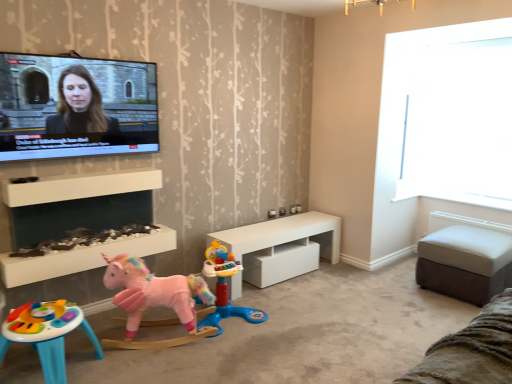
Question: Is transparent glass window at upper right at the back of white glossy table at center, the 2th table positioned from the right?

Choices:
 (A) yes
 (B) no

Answer: (B)

Question: Is white glossy table at center, which is the 1th table from left to right, far away from transparent glass window at upper right?

Choices:
 (A) yes
 (B) no

Answer: (A)

Question: From a real-world perspective, is white glossy table at center, which is the 1th table from left to right, located beneath transparent glass window at upper right?

Choices:
 (A) yes
 (B) no

Answer: (A)

Question: Is white glossy table at center, which is the 1th table from left to right, behind transparent glass window at upper right?

Choices:
 (A) no
 (B) yes

Answer: (A)

Question: From the image's perspective, is white glossy table at center, the 2th table positioned from the right, on transparent glass window at upper right?

Choices:
 (A) no
 (B) yes

Answer: (A)

Question: From a real-world perspective, is white glossy table at center, which is the 1th table from left to right, on top of transparent glass window at upper right?

Choices:
 (A) no
 (B) yes

Answer: (A)

Question: Does pink plush unicorn at lower left, arranged as the second toy when viewed from the left, have a smaller size compared to pink fabric unicorn at lower left, the third toy in the left-to-right sequence?

Choices:
 (A) yes
 (B) no

Answer: (A)

Question: Considering the relative positions of pink plush unicorn at lower left, arranged as the second toy when viewed from the left, and pink fabric unicorn at lower left, which is the first toy in right-to-left order, in the image provided, is pink plush unicorn at lower left, arranged as the second toy when viewed from the left, in front of pink fabric unicorn at lower left, which is the first toy in right-to-left order,?

Choices:
 (A) no
 (B) yes

Answer: (B)

Question: From a real-world perspective, is pink plush unicorn at lower left, arranged as the second toy when viewed from the left, located beneath pink fabric unicorn at lower left, the third toy in the left-to-right sequence?

Choices:
 (A) yes
 (B) no

Answer: (B)

Question: Does pink plush unicorn at lower left, acting as the second toy starting from the right, turn towards pink fabric unicorn at lower left, the third toy in the left-to-right sequence?

Choices:
 (A) no
 (B) yes

Answer: (A)

Question: Considering the relative sizes of pink plush unicorn at lower left, acting as the second toy starting from the right, and pink fabric unicorn at lower left, the third toy in the left-to-right sequence, in the image provided, is pink plush unicorn at lower left, acting as the second toy starting from the right, bigger than pink fabric unicorn at lower left, the third toy in the left-to-right sequence,?

Choices:
 (A) yes
 (B) no

Answer: (B)

Question: Considering the relative positions of pink plush unicorn at lower left, acting as the second toy starting from the right, and pink fabric unicorn at lower left, which is the first toy in right-to-left order, in the image provided, is pink plush unicorn at lower left, acting as the second toy starting from the right, to the right of pink fabric unicorn at lower left, which is the first toy in right-to-left order, from the viewer's perspective?

Choices:
 (A) yes
 (B) no

Answer: (B)

Question: From the image's perspective, is white matte shelf at center, positioned as the first shelf in top-to-bottom order, beneath white glossy table at center, the 2th table positioned from the right?

Choices:
 (A) yes
 (B) no

Answer: (B)